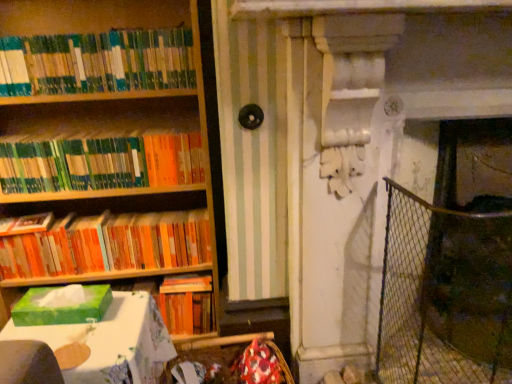
Question: Is green cardboard tissue box at lower left at the left side of green matte tissue box at left?

Choices:
 (A) yes
 (B) no

Answer: (B)

Question: Is green cardboard tissue box at lower left positioned in front of green matte tissue box at left?

Choices:
 (A) no
 (B) yes

Answer: (B)

Question: Can you confirm if green cardboard tissue box at lower left is wider than green matte tissue box at left?

Choices:
 (A) no
 (B) yes

Answer: (B)

Question: Is the depth of green cardboard tissue box at lower left greater than that of green matte tissue box at left?

Choices:
 (A) no
 (B) yes

Answer: (A)

Question: Is green cardboard tissue box at lower left aimed at green matte tissue box at left?

Choices:
 (A) yes
 (B) no

Answer: (B)

Question: From the image's perspective, relative to wire mesh fence at right, is green matte bookshelf at upper left, the 2th book in the top-to-bottom sequence, above or below?

Choices:
 (A) below
 (B) above

Answer: (B)

Question: In the image, is green matte bookshelf at upper left, acting as the 2th book starting from the bottom, on the left side or the right side of wire mesh fence at right?

Choices:
 (A) left
 (B) right

Answer: (A)

Question: Considering their positions, is green matte bookshelf at upper left, the 2th book in the top-to-bottom sequence, located in front of or behind wire mesh fence at right?

Choices:
 (A) behind
 (B) front

Answer: (A)

Question: In terms of width, does green matte bookshelf at upper left, the 2th book in the top-to-bottom sequence, look wider or thinner when compared to wire mesh fence at right?

Choices:
 (A) thin
 (B) wide

Answer: (A)

Question: From the image's perspective, is green matte bookshelf at upper left, the third book in the bottom-to-top sequence, located above or below green matte bookshelf at upper left, acting as the 2th book starting from the bottom?

Choices:
 (A) below
 (B) above

Answer: (B)

Question: Is green matte bookshelf at upper left, the third book in the bottom-to-top sequence, wider or thinner than green matte bookshelf at upper left, acting as the 2th book starting from the bottom?

Choices:
 (A) thin
 (B) wide

Answer: (A)

Question: From their relative heights in the image, would you say green matte bookshelf at upper left, the third book in the bottom-to-top sequence, is taller or shorter than green matte bookshelf at upper left, the 2th book in the top-to-bottom sequence?

Choices:
 (A) tall
 (B) short

Answer: (A)

Question: From a real-world perspective, relative to green matte bookshelf at upper left, the 2th book in the top-to-bottom sequence, is green matte bookshelf at upper left, the 1th book in the top-to-bottom sequence, vertically above or below?

Choices:
 (A) above
 (B) below

Answer: (A)

Question: Considering the positions of wire mesh fence at right and green matte bookshelf at upper left, the 2th book in the top-to-bottom sequence, in the image, is wire mesh fence at right wider or thinner than green matte bookshelf at upper left, the 2th book in the top-to-bottom sequence,?

Choices:
 (A) wide
 (B) thin

Answer: (A)

Question: Considering their positions, is wire mesh fence at right located in front of or behind green matte bookshelf at upper left, the 2th book in the top-to-bottom sequence?

Choices:
 (A) behind
 (B) front

Answer: (B)